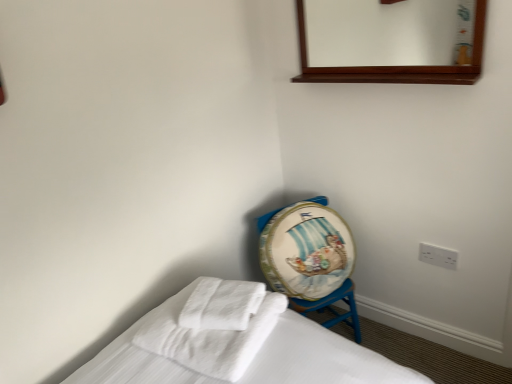
You are a GUI agent. You are given a task and a screenshot of the screen. Output one action in this format:
    pyautogui.click(x=<x>, y=<y>)
    Task: Click on the free space in front of white soft towel at center, the 1th bath towel from the right
    
    Given the screenshot: What is the action you would take?
    pyautogui.click(x=221, y=344)